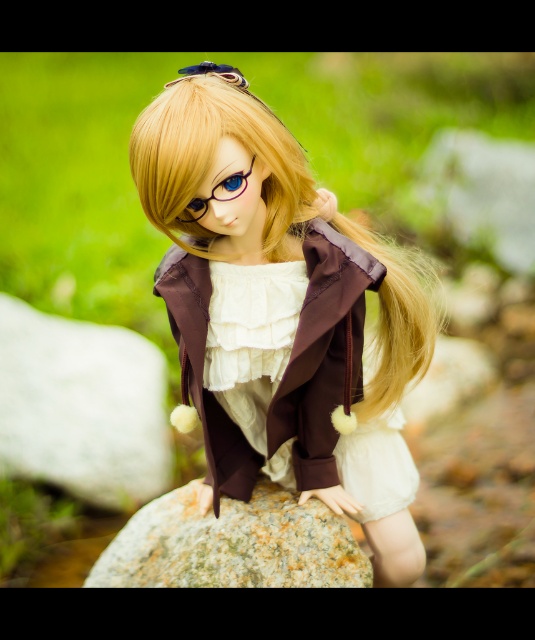
Is green speckled rock at center taller than matte brown hair at center?

No, green speckled rock at center is not taller than matte brown hair at center.

From the picture: Can you confirm if green speckled rock at center is wider than matte brown hair at center?

Yes, green speckled rock at center is wider than matte brown hair at center.

Between point (167, 502) and point (205, 76), which one is positioned in front?

Point (205, 76) is in front.

The width and height of the screenshot is (535, 640). Identify the location of green speckled rock at center. coord(233,545).

Is white satin dress at center above green speckled rock at center?

Yes, white satin dress at center is above green speckled rock at center.

Is point (218, 419) positioned before point (164, 568)?

Yes.

Which is in front, point (174, 259) or point (272, 483)?

Point (174, 259)

At what (x,y) coordinates should I click in order to perform the action: click on white satin dress at center. Please return your answer as a coordinate pair (x, y). The height and width of the screenshot is (640, 535). Looking at the image, I should click on (322, 353).

Which is behind, point (378, 492) or point (241, 524)?

The point (378, 492) is more distant.

Who is positioned more to the left, matte brown jacket at center or green speckled rock at center?

Positioned to the left is green speckled rock at center.

This screenshot has height=640, width=535. Describe the element at coordinates (281, 312) in the screenshot. I see `matte brown jacket at center` at that location.

Locate an element on the screen. matte brown jacket at center is located at coordinates (281, 312).